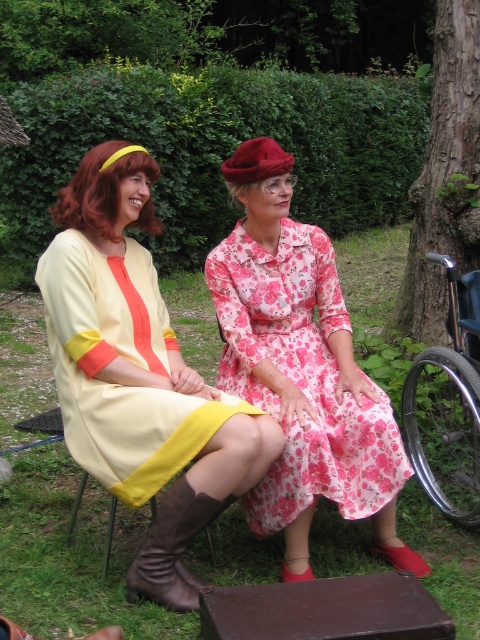
Question: Estimate the real-world distances between objects in this image. Which object is farther from the pink floral fabric dress at center?

Choices:
 (A) yellow fabric stool at lower left
 (B) matte yellow dress at center
 (C) brown leather boot at lower left

Answer: (A)

Question: Is brown leather boot at lower left wider than yellow fabric stool at lower left?

Choices:
 (A) no
 (B) yes

Answer: (A)

Question: Which of the following is the farthest from the observer?

Choices:
 (A) pink floral fabric dress at center
 (B) yellow fabric stool at lower left
 (C) silver metallic wheelchair at right
 (D) brown leather boot at lower left

Answer: (C)

Question: Is matte yellow dress at center smaller than brown leather boot at lower left?

Choices:
 (A) yes
 (B) no

Answer: (B)

Question: Which object appears closest to the camera in this image?

Choices:
 (A) matte yellow dress at center
 (B) pink floral fabric dress at center
 (C) silver metallic wheelchair at right
 (D) yellow fabric stool at lower left

Answer: (A)

Question: Observing the image, what is the correct spatial positioning of matte yellow dress at center in reference to pink floral fabric dress at center?

Choices:
 (A) below
 (B) above

Answer: (A)